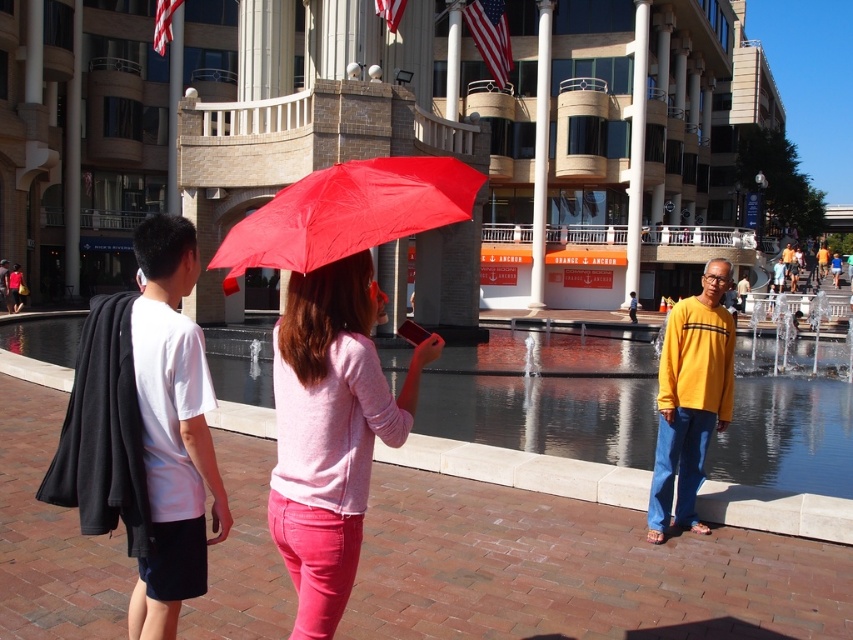
You are a photographer trying to capture a photo of the red matte umbrella at center and the matte pink sweater at center. Which object should you focus on first if you want to ensure both are in sharp focus, considering their heights?

The red matte umbrella at center is shorter than the matte pink sweater at center, so you should focus on the red matte umbrella at center first to ensure both are in sharp focus.